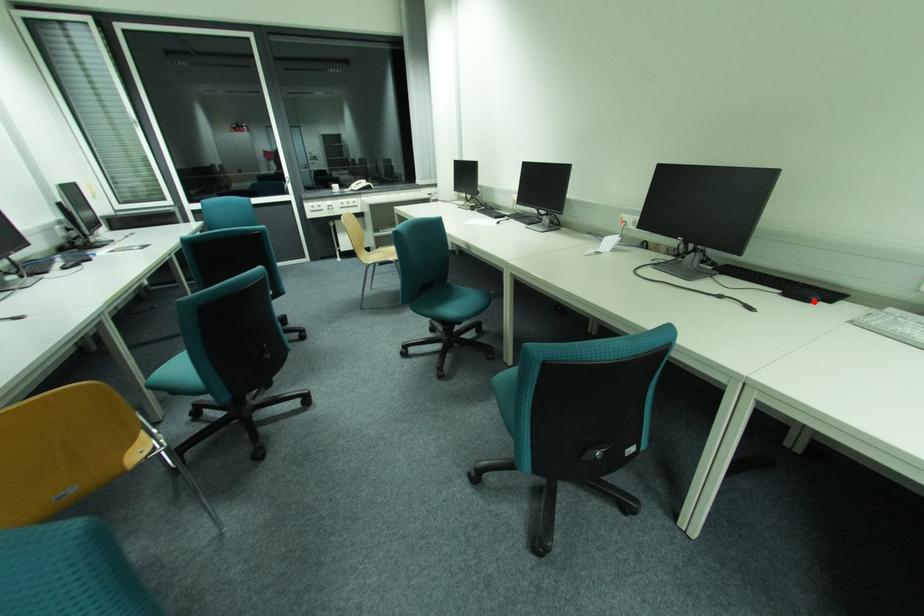
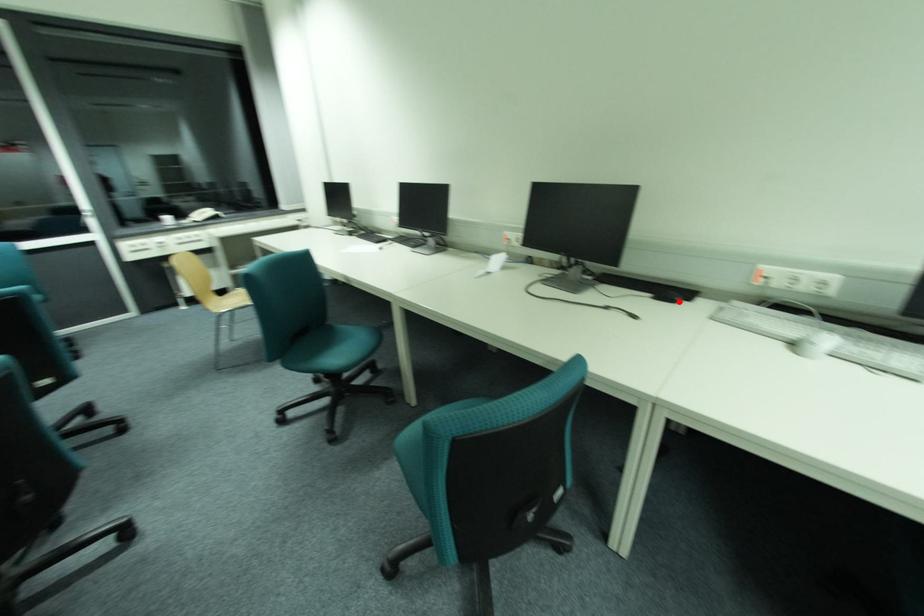
I am providing you with two images of the same scene from different viewpoints. A red point is marked on the first image and another point is marked on the second image. Is the red point in image1 aligned with the point shown in image2?

Yes